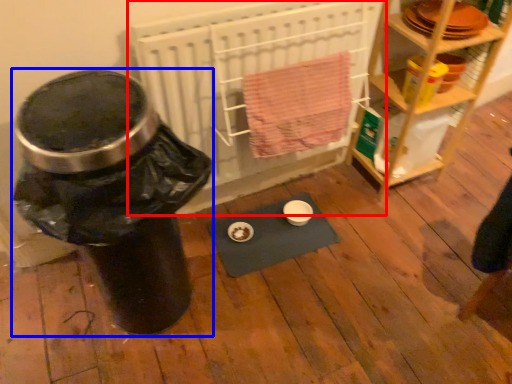
Question: Which of the following is the closest to the observer, wide (highlighted by a red box) or water cooler (highlighted by a blue box)?

Choices:
 (A) wide
 (B) water cooler

Answer: (B)